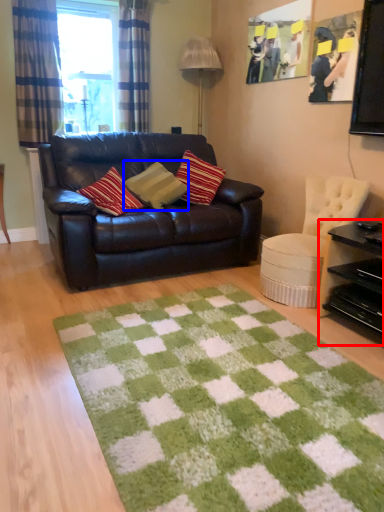
Question: Which point is further to the camera, table (highlighted by a red box) or pillow (highlighted by a blue box)?

Choices:
 (A) table
 (B) pillow

Answer: (B)